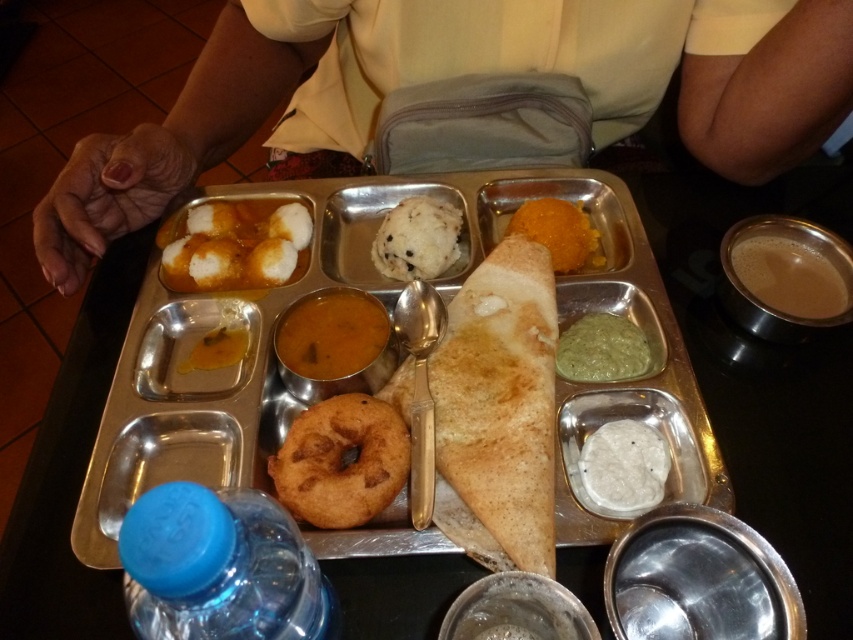
You are a food delivery person who needs to hand over the blue plastic bottle at lower left to the customer. The customer is standing 25 centimeters away from the tray. Can you reach the bottle without moving the tray?

The blue plastic bottle at lower left is 23.70 centimeters away from the customer, so yes, you can reach it without moving the tray since the distance is within the required 25 centimeters.

You are a delivery person who needs to pick up a blue plastic bottle from a metal tray. The tray has multiple food items arranged in compartments. The coordinates of the blue plastic bottle are given as point 0.887 on the x axis and 0.258 on the y axis. Can you locate the blue plastic bottle at point [219,566]?

The blue plastic bottle at lower left is located at point [219,566].